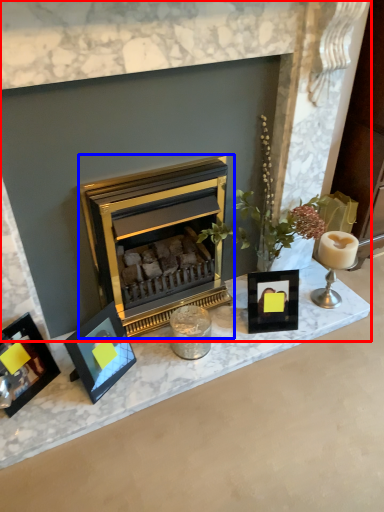
Question: Among these objects, which one is farthest to the camera, fireplace (highlighted by a red box) or wood burning stove (highlighted by a blue box)?

Choices:
 (A) fireplace
 (B) wood burning stove

Answer: (B)